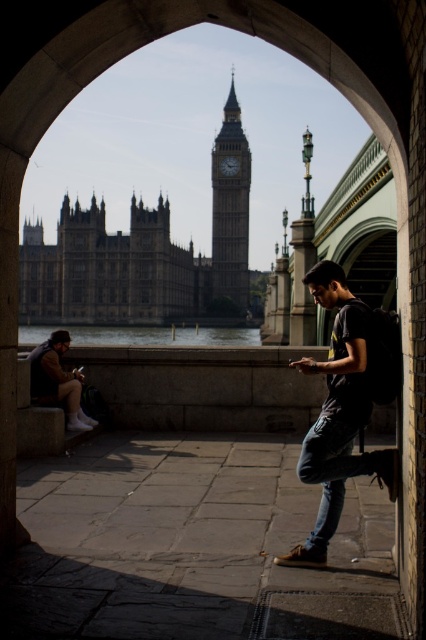
Is brown stone building at center bigger than polished stone clock tower at center?

Indeed, brown stone building at center has a larger size compared to polished stone clock tower at center.

Based on the photo, does brown stone building at center have a greater width compared to polished stone clock tower at center?

Correct, the width of brown stone building at center exceeds that of polished stone clock tower at center.

Locate an element on the screen. brown stone building at center is located at coordinates (111, 269).

Is point (313, 440) positioned before point (226, 209)?

That is True.

Does dark blue jeans at center have a lesser width compared to polished stone clock tower at center?

Incorrect, dark blue jeans at center's width is not less than polished stone clock tower at center's.

Describe the element at coordinates (342, 404) in the screenshot. I see `dark blue jeans at center` at that location.

Locate an element on the screen. dark blue jeans at center is located at coordinates (342, 404).

Can you confirm if polished stone clock tower at center is wider than dark brown leather jacket at lower left?

Incorrect, polished stone clock tower at center's width does not surpass dark brown leather jacket at lower left's.

Identify the location of polished stone clock tower at center. The image size is (426, 640). (230, 209).